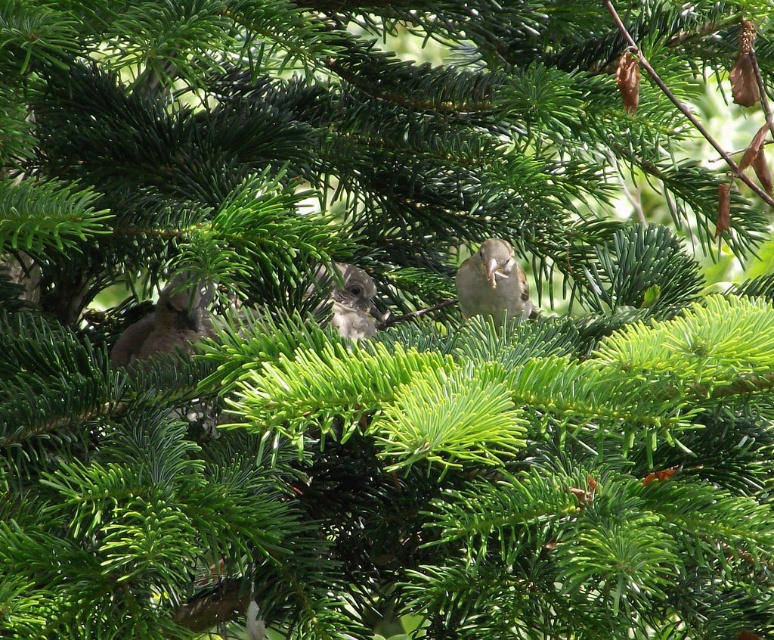
Is brown feathered bird at left above brown feathered bird at center?

No, brown feathered bird at left is not above brown feathered bird at center.

Looking at this image, can you confirm if brown feathered bird at left is wider than brown feathered bird at center?

Correct, the width of brown feathered bird at left exceeds that of brown feathered bird at center.

This screenshot has width=774, height=640. What do you see at coordinates (165, 323) in the screenshot?
I see `brown feathered bird at left` at bounding box center [165, 323].

Locate an element on the screen. Image resolution: width=774 pixels, height=640 pixels. brown feathered bird at left is located at coordinates (165, 323).

Between brown feathered bird at left and brown speckled feathers at center, which one has less height?

Standing shorter between the two is brown feathered bird at left.

From the picture: Who is taller, brown feathered bird at left or brown speckled feathers at center?

With more height is brown speckled feathers at center.

Who is more forward, (x=156, y=305) or (x=495, y=250)?

Positioned in front is point (x=495, y=250).

Find the location of a particular element. The image size is (774, 640). brown feathered bird at left is located at coordinates click(165, 323).

Is brown speckled feathers at center further to camera compared to brown feathered bird at center?

Yes, it is.

Does brown speckled feathers at center have a greater width compared to brown feathered bird at center?

Yes, brown speckled feathers at center is wider than brown feathered bird at center.

Image resolution: width=774 pixels, height=640 pixels. I want to click on brown speckled feathers at center, so click(x=492, y=284).